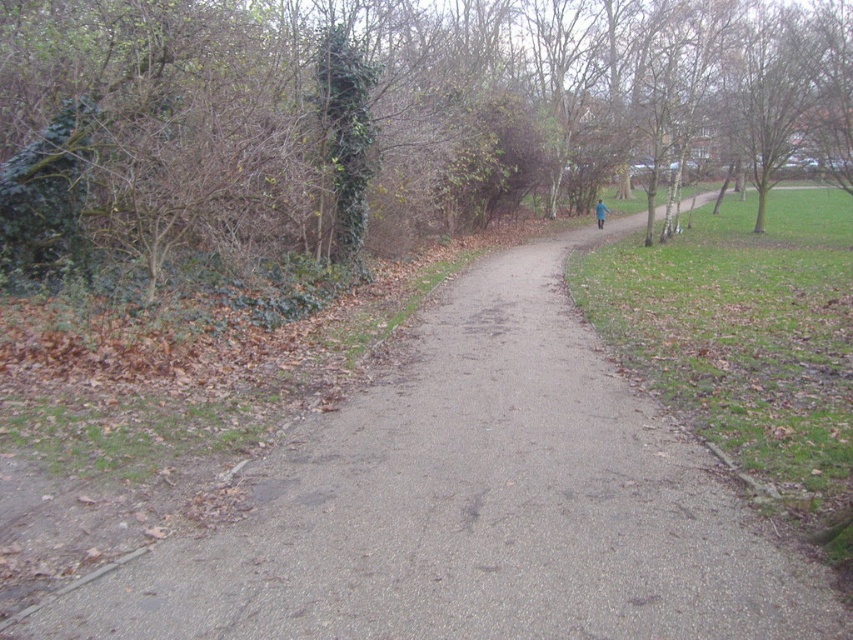
Question: Which point is closer to the camera taking this photo?

Choices:
 (A) (519, 600)
 (B) (585, 49)
 (C) (599, 216)

Answer: (A)

Question: Which point is closer to the camera?

Choices:
 (A) (602, 212)
 (B) (100, 620)

Answer: (B)

Question: Can you confirm if green ivy-covered tree at left is thinner than gray asphalt trail at center?

Choices:
 (A) no
 (B) yes

Answer: (A)

Question: Is green ivy-covered tree at left above gray asphalt trail at center?

Choices:
 (A) yes
 (B) no

Answer: (A)

Question: Which point is closer to the camera taking this photo?

Choices:
 (A) (602, 202)
 (B) (254, 150)
 (C) (561, 340)

Answer: (B)

Question: Can you confirm if green ivy-covered tree at left is positioned to the left of gray asphalt trail at center?

Choices:
 (A) no
 (B) yes

Answer: (A)